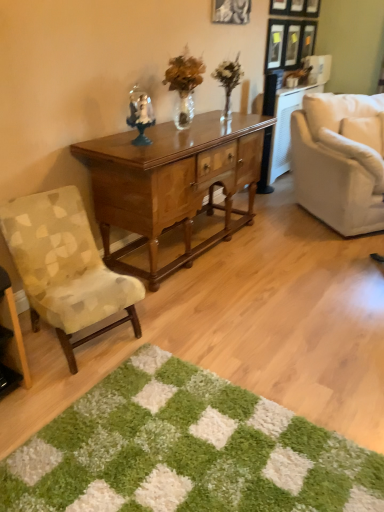
Find the location of a particular element. Image resolution: width=384 pixels, height=512 pixels. vacant area that lies between white fabric chair at right, which is the first chair from right to left, and green shaggy rug at lower center is located at coordinates (292, 297).